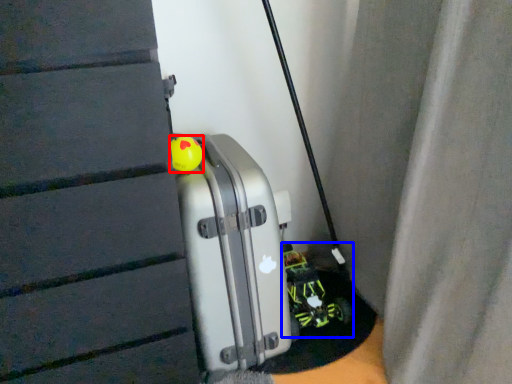
Question: Which object appears closest to the camera in this image, toy (highlighted by a red box) or toy car (highlighted by a blue box)?

Choices:
 (A) toy
 (B) toy car

Answer: (A)